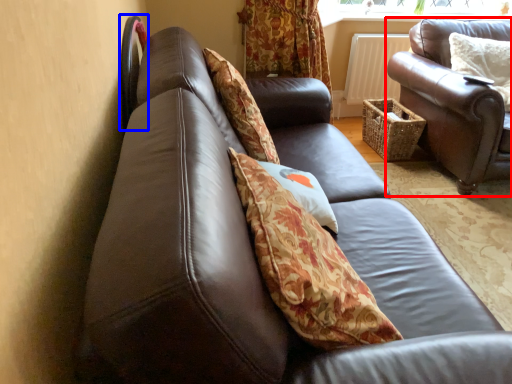
Question: Which object appears closest to the camera in this image, studio couch (highlighted by a red box) or chair (highlighted by a blue box)?

Choices:
 (A) studio couch
 (B) chair

Answer: (B)